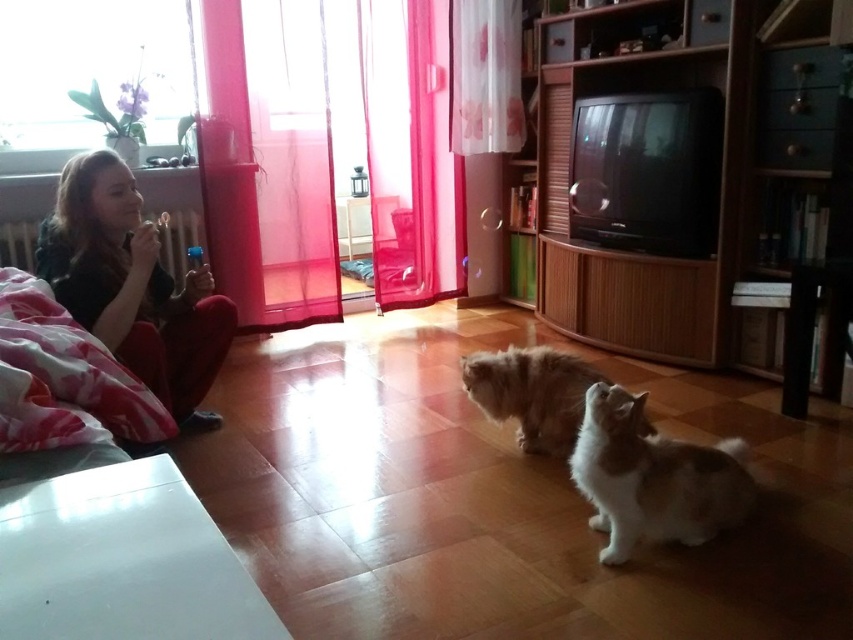
You are a photographer trying to capture a photo of the fluffy brown cat at center without including the matte black shirt at left in the frame. Given their sizes, is it possible to adjust your position to exclude the shirt?

The matte black shirt at left is wider than the fluffy brown cat at center. By moving the camera to the side away from the matte black shirt at left, you can focus on the fluffy brown cat at center and avoid including the shirt in the frame.